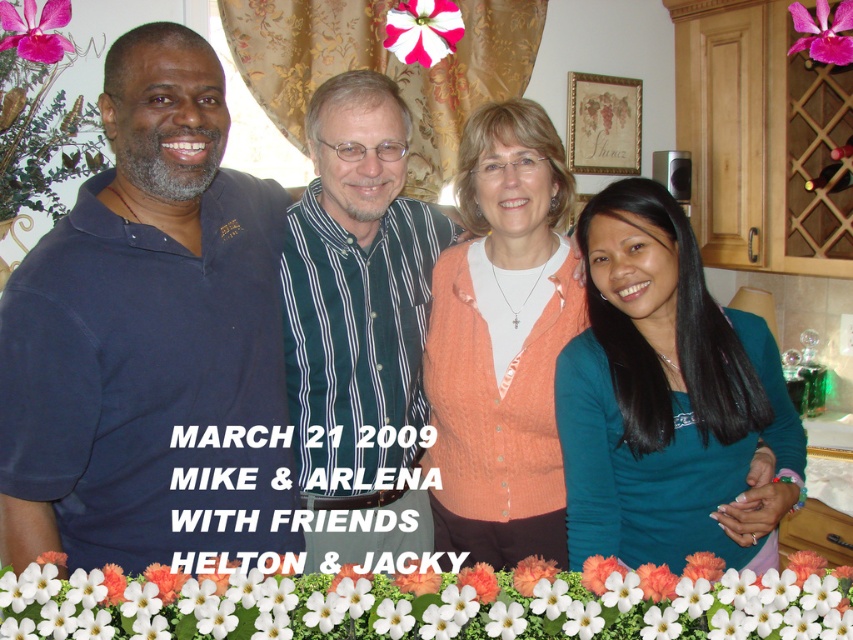
You are arranging flowers for a kitchen photo shoot and have two options displayed in the image. The white matte flower at upper center and the purple silk flower at upper left. Which flower would you choose if you want the larger one for the centerpiece?

The white matte flower at upper center is bigger than the purple silk flower at upper left, so you should choose the white matte flower at upper center for the centerpiece.

You are arranging flowers for a centerpiece in the kitchen. You have a white matte flower at upper center and a purple silk flower at upper left. According to the image, which flower should you place to the left of the other?

The white matte flower at upper center should be placed to the right of the purple silk flower at upper left, so the purple silk flower at upper left should be positioned to the left of the white matte flower at upper center.

You are standing in the kitchen and want to reach a point that is 1.32 meters away from your current position. If you move forward exactly 1.32 meters, will you reach the point marked at coordinates point (187,419)?

Yes, the point marked at coordinates point (187,419) is exactly 1.32 meters away from the camera, so moving forward precisely 1.32 meters would reach it.